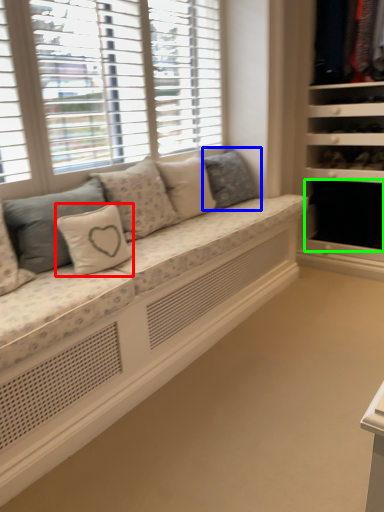
Question: Which object is the farthest from pillow (highlighted by a red box)? Choose among these: pillow (highlighted by a blue box) or shelf (highlighted by a green box).

Choices:
 (A) pillow
 (B) shelf

Answer: (B)